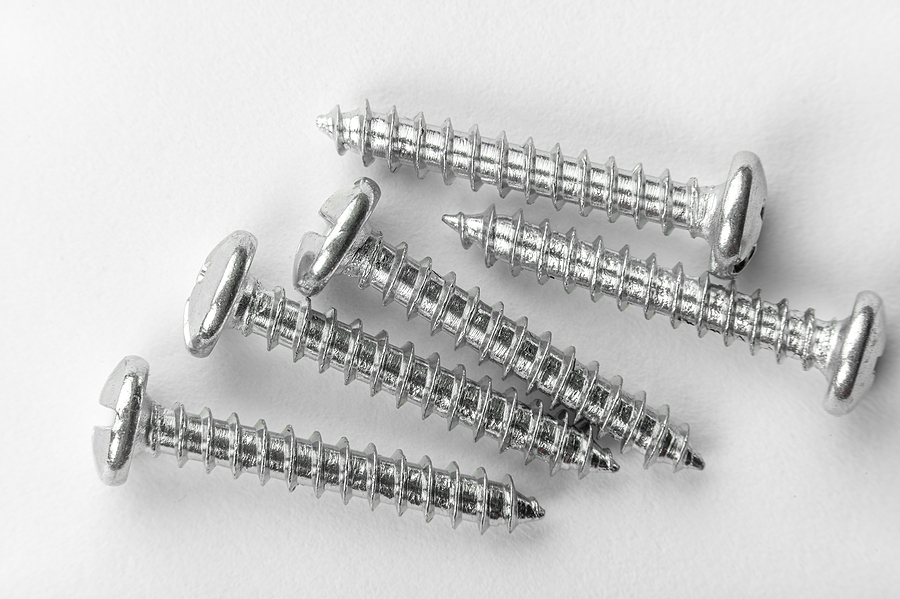
You are a GUI agent. You are given a task and a screenshot of the screen. Output one action in this format:
    pyautogui.click(x=<x>, y=<y>)
    Task: Click on the table
    The height and width of the screenshot is (599, 900).
    Given the screenshot: What is the action you would take?
    pyautogui.click(x=420, y=216)